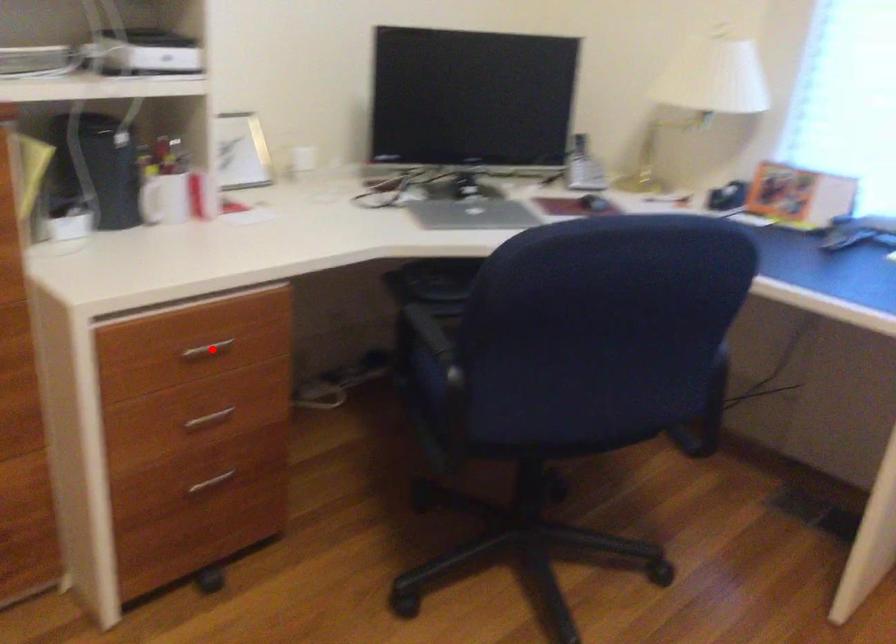
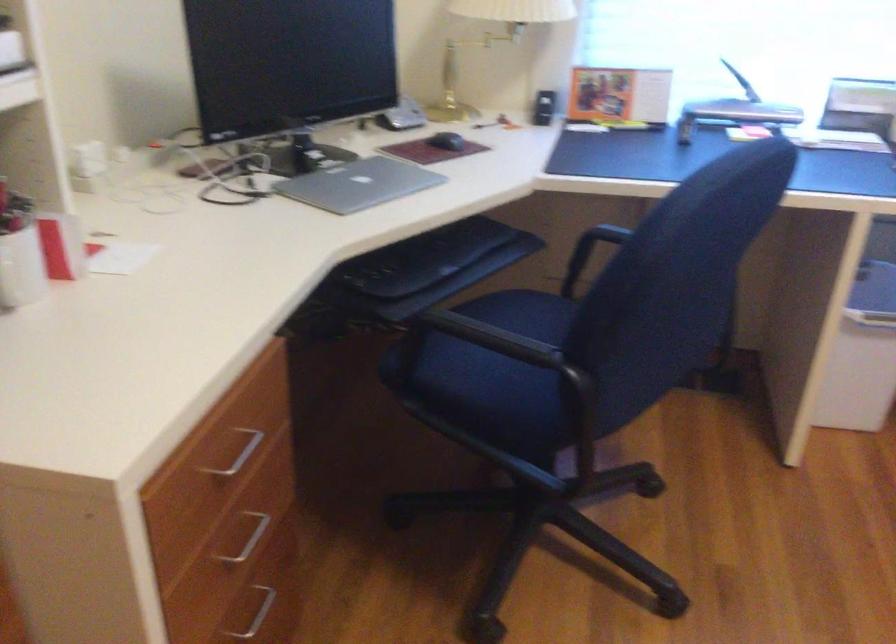
Question: I am providing you with two images of the same scene from different viewpoints. Image1 has a red point marked. In image2, the corresponding 3D location appears at what relative position? Reply with the corresponding letter.

Choices:
 (A) Closer
 (B) Farther

Answer: (A)